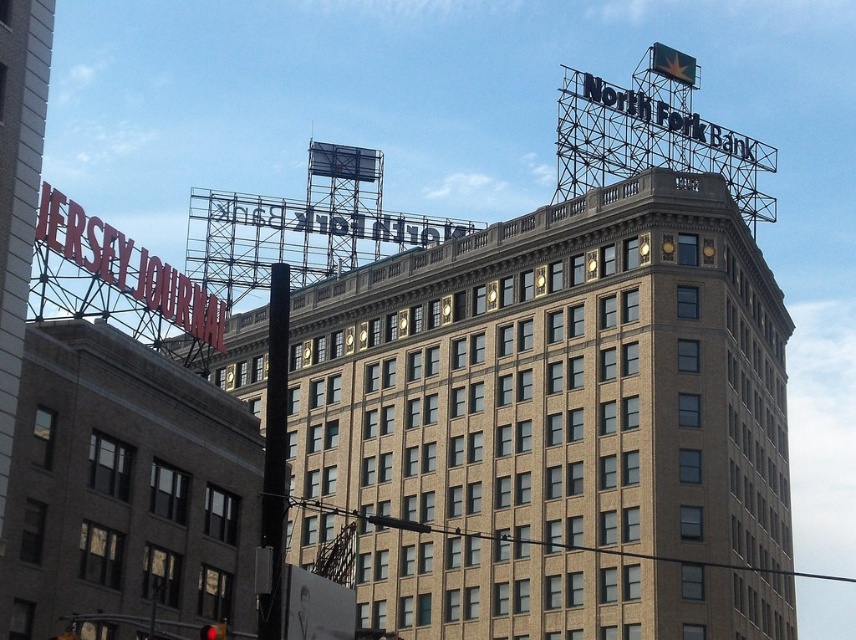
Which is below, brown brick building at center or red metal sign at upper left?

brown brick building at center is lower down.

Is brown brick building at center above red metal sign at upper left?

No, brown brick building at center is not above red metal sign at upper left.

Which is behind, point (467, 246) or point (97, 266)?

Point (467, 246)

Locate an element on the screen. brown brick building at center is located at coordinates (557, 422).